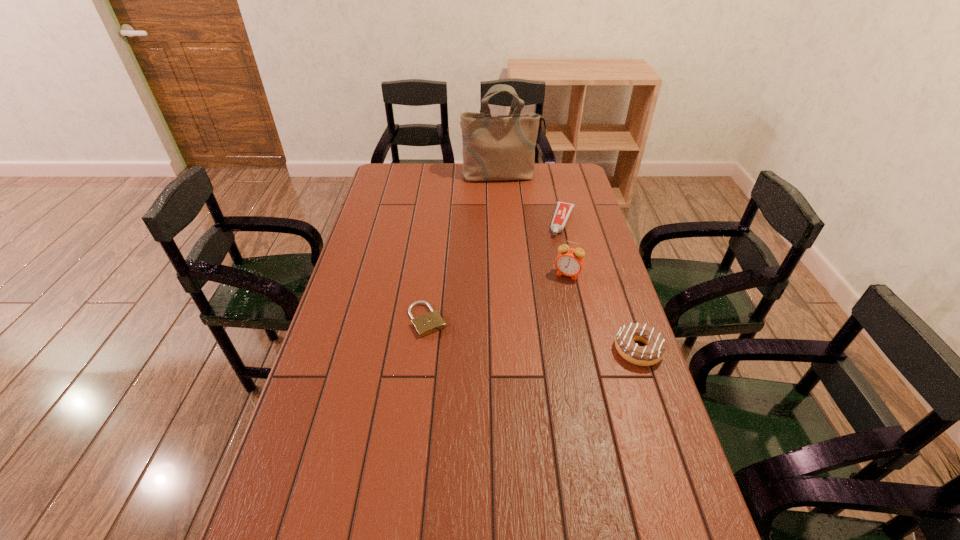
Identify the location of vacant space on the desktop that is between the shortest object and the third tallest object and is positioned on the face of the third farthest object. (541, 336).

At what (x,y) coordinates should I click in order to perform the action: click on free spot on the desktop that is between the padlock and the rightmost object and is positioned on the front-facing side of the farthest object. Please return your answer as a coordinate pair (x, y). Looking at the image, I should click on (541, 336).

Where is `free space on the desktop that is between the padlock and the doughnut and is positioned at the nozzle of the fourth tallest object`? The image size is (960, 540). free space on the desktop that is between the padlock and the doughnut and is positioned at the nozzle of the fourth tallest object is located at coordinates (521, 334).